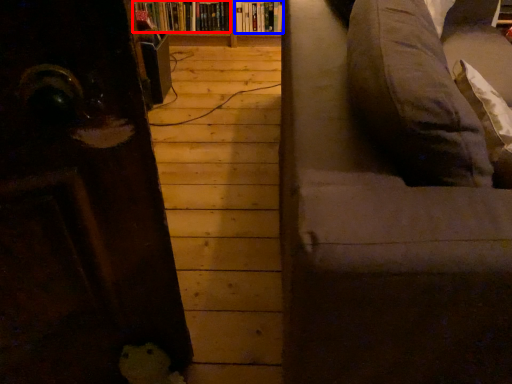
Question: Which object is further to the camera taking this photo, book (highlighted by a red box) or book (highlighted by a blue box)?

Choices:
 (A) book
 (B) book

Answer: (A)